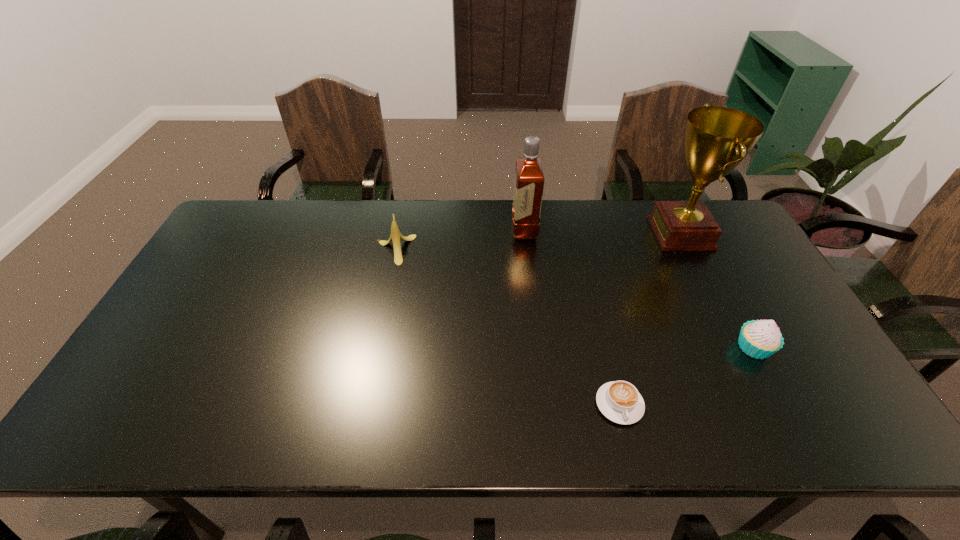
Where is `vacant space that satisfies the following two spatial constraints: 1. on the plaque of the tallest object; 2. on the side of the nearest object with the handle`? Image resolution: width=960 pixels, height=540 pixels. vacant space that satisfies the following two spatial constraints: 1. on the plaque of the tallest object; 2. on the side of the nearest object with the handle is located at coordinates (767, 404).

Where is `free point that satisfies the following two spatial constraints: 1. on the front label of the liquor; 2. on the left side of the cupcake`? free point that satisfies the following two spatial constraints: 1. on the front label of the liquor; 2. on the left side of the cupcake is located at coordinates (538, 347).

Find the location of `free space in the image that satisfies the following two spatial constraints: 1. on the front label of the second object from left to right; 2. on the front side of the leftmost object`. free space in the image that satisfies the following two spatial constraints: 1. on the front label of the second object from left to right; 2. on the front side of the leftmost object is located at coordinates (527, 249).

Where is `free space that satisfies the following two spatial constraints: 1. on the plaque of the award; 2. on the side of the nearest object with the handle`? Image resolution: width=960 pixels, height=540 pixels. free space that satisfies the following two spatial constraints: 1. on the plaque of the award; 2. on the side of the nearest object with the handle is located at coordinates (767, 404).

Locate an element on the screen. The height and width of the screenshot is (540, 960). free space that satisfies the following two spatial constraints: 1. on the front label of the cupcake; 2. on the right side of the fourth shortest object is located at coordinates (538, 347).

The image size is (960, 540). In order to click on free location that satisfies the following two spatial constraints: 1. on the back side of the cupcake; 2. on the plaque of the award in this screenshot , I will do `click(693, 233)`.